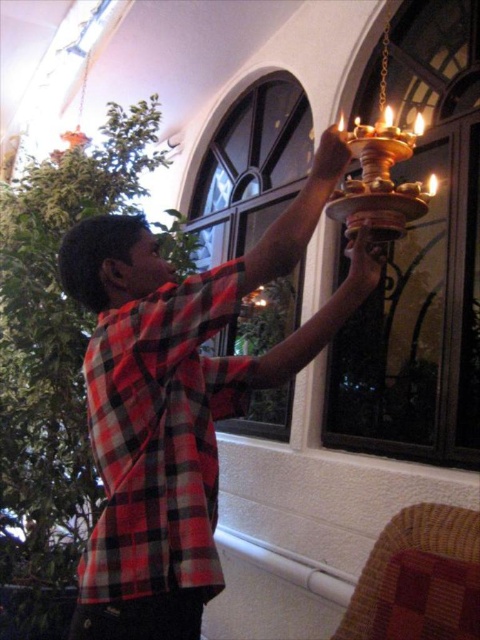
Describe the element at coordinates (178, 401) in the screenshot. I see `red plaid shirt at center` at that location.

Does red plaid shirt at center lie behind red plaid shirt at upper center?

No, it is not.

Does point (260, 272) lie in front of point (243, 404)?

Yes, point (260, 272) is in front of point (243, 404).

Identify the location of red plaid shirt at center. This screenshot has height=640, width=480. (178, 401).